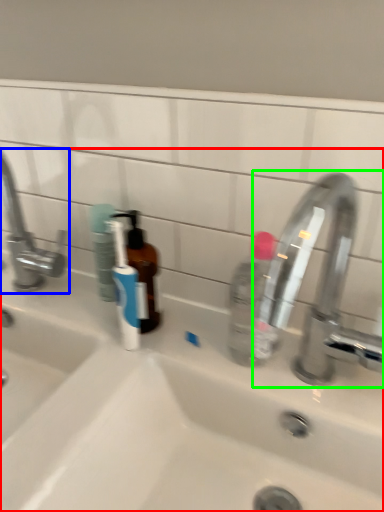
Question: Which object is positioned farthest from sink (highlighted by a red box)? Select from tap (highlighted by a blue box) and tap (highlighted by a green box).

Choices:
 (A) tap
 (B) tap

Answer: (A)